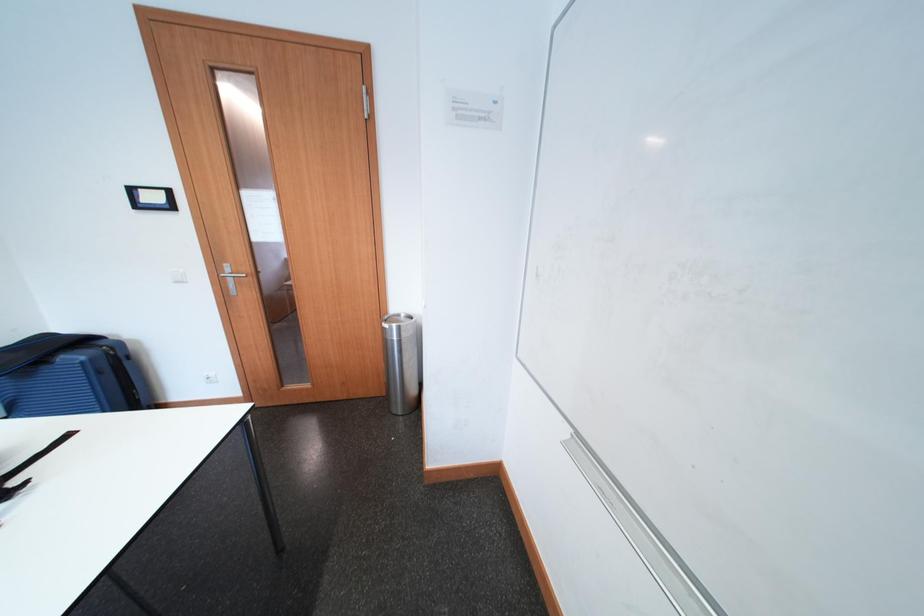
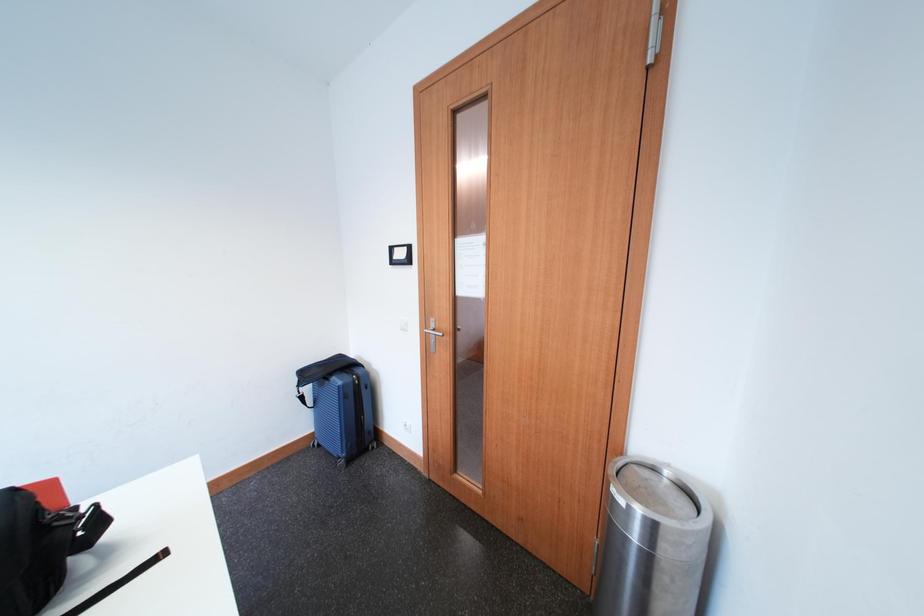
Question: The camera is either moving clockwise (left) or counter-clockwise (right) around the object. The first image is from the beginning of the video and the second image is from the end. Is the camera moving left or right when shooting the video?

Choices:
 (A) Left
 (B) Right

Answer: (B)